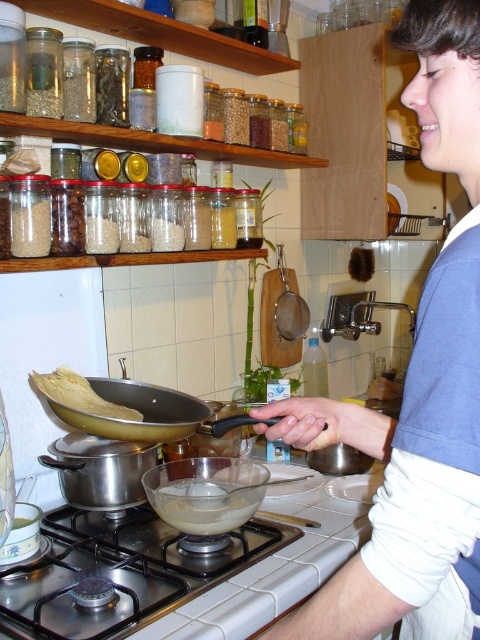
You are a chef observing the kitchen scene. You need to access the translucent glass bowl at center to check its contents. Is the blue cotton shirt at upper right blocking your direct access to it?

The blue cotton shirt at upper right is in front of the translucent glass bowl at center, so it is blocking direct access to the bowl.

You are a chef in the kitchen and need to reach both the gold matte wok at center and the yellow matte pancake at center. Which one would you need to reach further back to grab?

You would need to reach further back to grab the yellow matte pancake at center because the gold matte wok at center is closer to the viewer, meaning the pancake is positioned behind it.